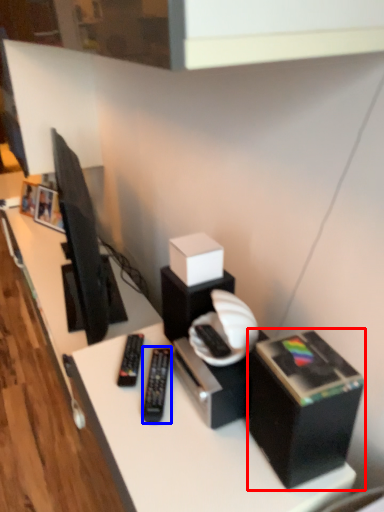
Question: Which of the following is the closest to the observer, box (highlighted by a red box) or equipment (highlighted by a blue box)?

Choices:
 (A) box
 (B) equipment

Answer: (A)